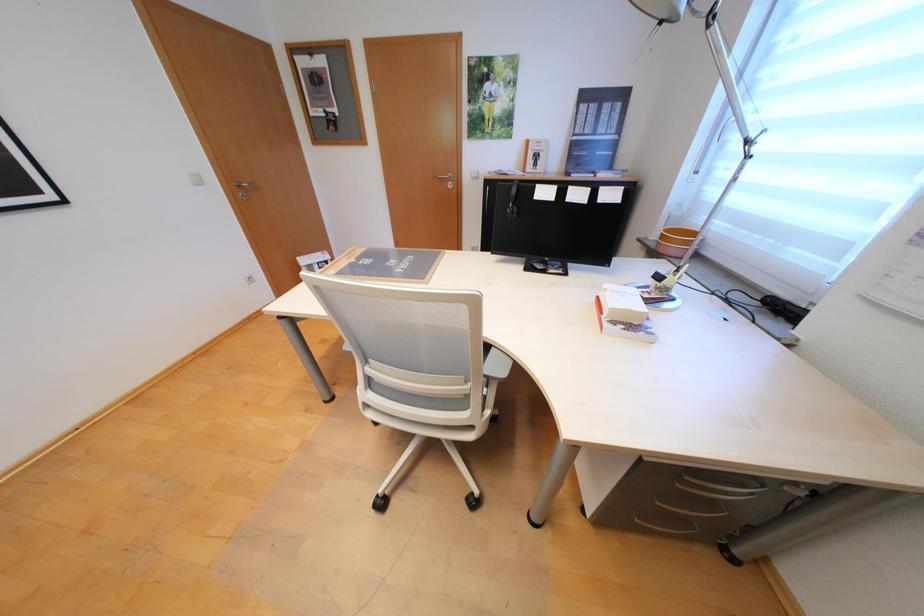
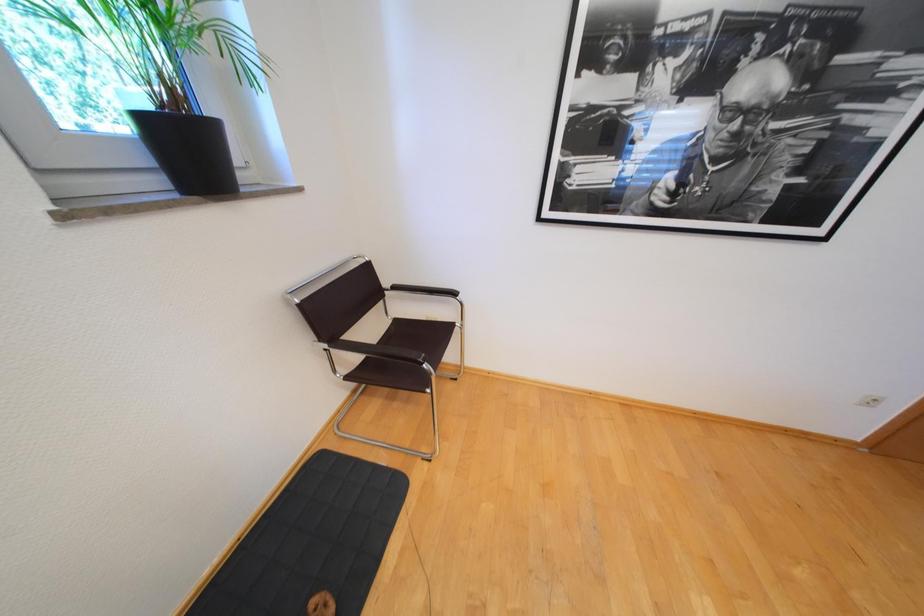
In the scene shown: Based on the continuous images, in which direction is the camera rotating?

The camera's rotation is toward left-down.